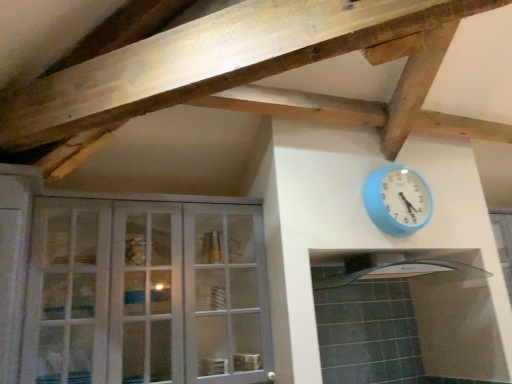
This screenshot has height=384, width=512. I want to click on white glass cabinet at left, so click(x=146, y=293).

From a real-world perspective, is white glass cabinet at left beneath clear glass exhaust hood at center?

Yes, from a real-world perspective, white glass cabinet at left is under clear glass exhaust hood at center.

Can you confirm if white glass cabinet at left is bigger than clear glass exhaust hood at center?

Indeed, white glass cabinet at left has a larger size compared to clear glass exhaust hood at center.

Is point (226, 252) farther from viewer compared to point (315, 284)?

That is False.

Is blue plastic wall clock at upper right to the right of clear glass exhaust hood at center from the viewer's perspective?

Indeed, blue plastic wall clock at upper right is positioned on the right side of clear glass exhaust hood at center.

Can you tell me how much blue plastic wall clock at upper right and clear glass exhaust hood at center differ in facing direction?

The angle between the facing direction of blue plastic wall clock at upper right and the facing direction of clear glass exhaust hood at center is 1.42 degrees.

Is the position of blue plastic wall clock at upper right more distant than that of clear glass exhaust hood at center?

Yes.

Which is correct: blue plastic wall clock at upper right is inside clear glass exhaust hood at center, or outside of it?

blue plastic wall clock at upper right lies outside clear glass exhaust hood at center.

In the scene shown: Do you think clear glass exhaust hood at center is within white glass cabinet at left, or outside of it?

clear glass exhaust hood at center exists outside the volume of white glass cabinet at left.

How different are the orientations of clear glass exhaust hood at center and white glass cabinet at left in degrees?

2.9 degrees.

Is point (372, 255) closer or farther from the camera than point (74, 278)?

Clearly, point (372, 255) is more distant from the camera than point (74, 278).

Considering the sizes of objects clear glass exhaust hood at center and white glass cabinet at left in the image provided, who is shorter, clear glass exhaust hood at center or white glass cabinet at left?

clear glass exhaust hood at center is shorter.

Does point (95, 247) lie behind point (390, 220)?

No, (95, 247) is closer to viewer.

From the image's perspective, who appears lower, white glass cabinet at left or blue plastic wall clock at upper right?

white glass cabinet at left.

The image size is (512, 384). I want to click on wall clock lying above the white glass cabinet at left (from the image's perspective), so click(397, 200).

Is white glass cabinet at left positioned with its back to blue plastic wall clock at upper right?

No, white glass cabinet at left is not facing away from blue plastic wall clock at upper right.

Is blue plastic wall clock at upper right not inside white glass cabinet at left?

blue plastic wall clock at upper right lies outside white glass cabinet at left's area.

Is blue plastic wall clock at upper right at the right side of white glass cabinet at left?

Yes.

Is the depth of blue plastic wall clock at upper right less than that of white glass cabinet at left?

That is False.

Can you confirm if blue plastic wall clock at upper right is taller than white glass cabinet at left?

Incorrect, the height of blue plastic wall clock at upper right is not larger of that of white glass cabinet at left.

Can you confirm if clear glass exhaust hood at center is positioned to the left of blue plastic wall clock at upper right?

Yes, clear glass exhaust hood at center is to the left of blue plastic wall clock at upper right.

Considering the positions of objects clear glass exhaust hood at center and blue plastic wall clock at upper right in the image provided, who is behind, clear glass exhaust hood at center or blue plastic wall clock at upper right?

blue plastic wall clock at upper right is further from the camera.

The image size is (512, 384). I want to click on exhaust hood below the blue plastic wall clock at upper right (from the image's perspective), so click(393, 269).

Is clear glass exhaust hood at center thinner than blue plastic wall clock at upper right?

In fact, clear glass exhaust hood at center might be wider than blue plastic wall clock at upper right.

Identify the location of cabinetry below the clear glass exhaust hood at center (from the image's perspective). (146, 293).

Identify the location of wall clock above the clear glass exhaust hood at center (from a real-world perspective). (397, 200).

From the picture: From the image, which object appears to be farther from clear glass exhaust hood at center, white glass cabinet at left or blue plastic wall clock at upper right?

white glass cabinet at left lies further to clear glass exhaust hood at center than the other object.

Estimate the real-world distances between objects in this image. Which object is further from clear glass exhaust hood at center, blue plastic wall clock at upper right or white glass cabinet at left?

Based on the image, white glass cabinet at left appears to be further to clear glass exhaust hood at center.

When comparing their distances from blue plastic wall clock at upper right, does clear glass exhaust hood at center or white glass cabinet at left seem closer?

clear glass exhaust hood at center.

Which object lies further to the anchor point white glass cabinet at left, clear glass exhaust hood at center or blue plastic wall clock at upper right?

blue plastic wall clock at upper right.

Which object lies nearer to the anchor point blue plastic wall clock at upper right, white glass cabinet at left or clear glass exhaust hood at center?

Among the two, clear glass exhaust hood at center is located nearer to blue plastic wall clock at upper right.

From the image, which object appears to be nearer to white glass cabinet at left, blue plastic wall clock at upper right or clear glass exhaust hood at center?

Among the two, clear glass exhaust hood at center is located nearer to white glass cabinet at left.

Identify the location of exhaust hood between white glass cabinet at left and blue plastic wall clock at upper right from left to right. Image resolution: width=512 pixels, height=384 pixels. (393, 269).